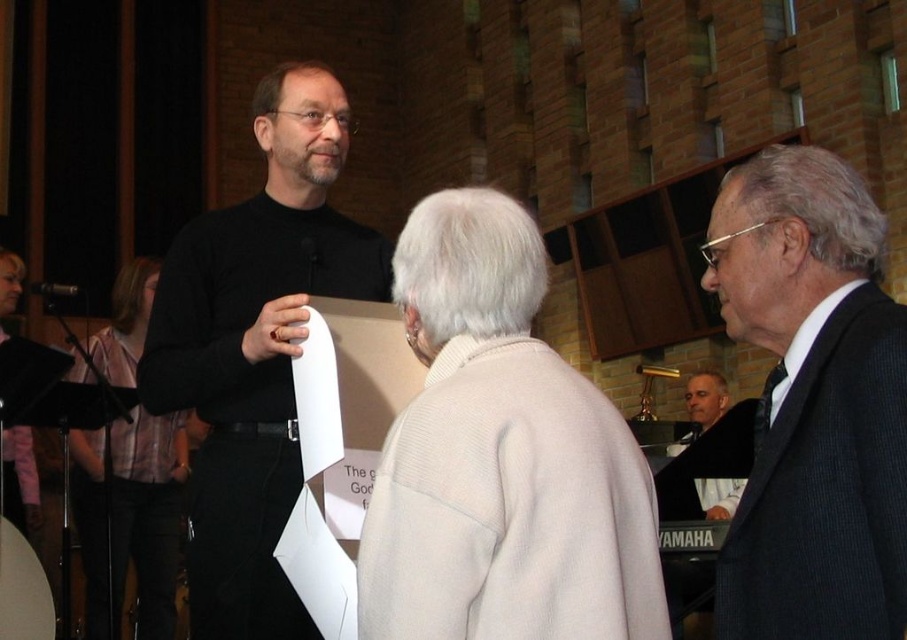
Does point (413, 307) lie in front of point (701, 428)?

Yes.

Is white woolen sweater at center to the right of gray hair at center from the viewer's perspective?

No, white woolen sweater at center is not to the right of gray hair at center.

Is point (470, 228) positioned after point (710, 376)?

No, (470, 228) is closer to viewer.

This screenshot has height=640, width=907. I want to click on white woolen sweater at center, so coord(500,458).

Measure the distance between point [288,291] and camera.

3.68 meters

Looking at this image, who is more distant from viewer, (196, 323) or (704, 397)?

The point (704, 397) is more distant.

Which is in front, point (249, 458) or point (714, 385)?

Positioned in front is point (249, 458).

Locate an element on the screen. black matte sweater at center is located at coordinates (256, 348).

Between white woolen sweater at center and black matte sweater at center, which one has less height?

Standing shorter between the two is white woolen sweater at center.

Does point (446, 337) come closer to viewer compared to point (197, 250)?

Yes, it is in front of point (197, 250).

Where is `white woolen sweater at center`? Image resolution: width=907 pixels, height=640 pixels. white woolen sweater at center is located at coordinates (500, 458).